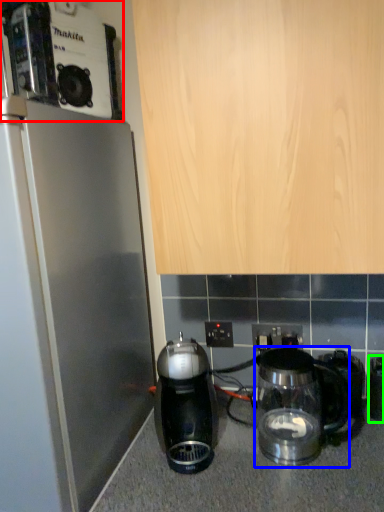
Question: Estimate the real-world distances between objects in this image. Which object is closer to coffee maker (highlighted by a red box), kitchen appliance (highlighted by a blue box) or appliance (highlighted by a green box)?

Choices:
 (A) kitchen appliance
 (B) appliance

Answer: (A)